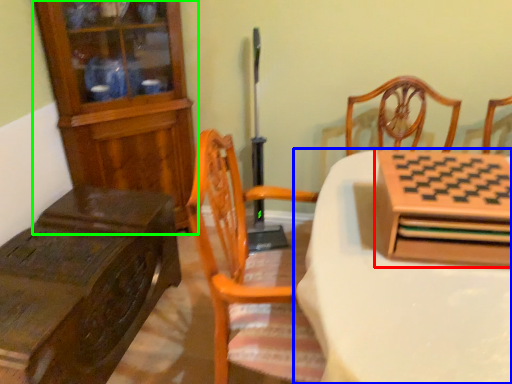
Question: Considering the real-world distances, which object is closest to cabinetry (highlighted by a red box)? table (highlighted by a blue box) or cabinetry (highlighted by a green box).

Choices:
 (A) table
 (B) cabinetry

Answer: (A)